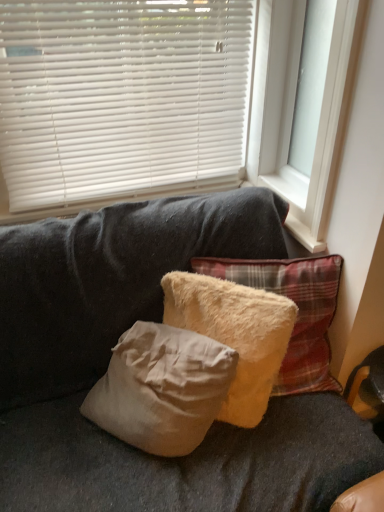
Question: Does white plastic blinds at upper center have a greater height compared to white plastic window frame at upper right?

Choices:
 (A) no
 (B) yes

Answer: (A)

Question: Is white plastic blinds at upper center next to white plastic window frame at upper right and touching it?

Choices:
 (A) yes
 (B) no

Answer: (B)

Question: Does white plastic blinds at upper center have a greater width compared to white plastic window frame at upper right?

Choices:
 (A) yes
 (B) no

Answer: (B)

Question: Considering the relative sizes of white plastic blinds at upper center and white plastic window frame at upper right in the image provided, is white plastic blinds at upper center bigger than white plastic window frame at upper right?

Choices:
 (A) no
 (B) yes

Answer: (B)

Question: Is white plastic blinds at upper center at the right side of white plastic window frame at upper right?

Choices:
 (A) no
 (B) yes

Answer: (A)

Question: From the image's perspective, does white plastic blinds at upper center appear higher than white plastic window frame at upper right?

Choices:
 (A) no
 (B) yes

Answer: (B)

Question: Does white plastic window frame at upper right have a lesser height compared to beige fluffy pillow at center, positioned as the second pillow in right-to-left order?

Choices:
 (A) yes
 (B) no

Answer: (B)

Question: Does white plastic window frame at upper right appear on the left side of beige fluffy pillow at center, positioned as the second pillow in right-to-left order?

Choices:
 (A) no
 (B) yes

Answer: (A)

Question: Is white plastic window frame at upper right bigger than beige fluffy pillow at center, which ranks as the first pillow in left-to-right order?

Choices:
 (A) yes
 (B) no

Answer: (A)

Question: From the image's perspective, is white plastic window frame at upper right under beige fluffy pillow at center, which ranks as the first pillow in left-to-right order?

Choices:
 (A) yes
 (B) no

Answer: (B)

Question: Would you say white plastic window frame at upper right is a long distance from beige fluffy pillow at center, positioned as the second pillow in right-to-left order?

Choices:
 (A) yes
 (B) no

Answer: (B)

Question: Considering the relative sizes of white plastic window frame at upper right and beige fluffy pillow at center, positioned as the second pillow in right-to-left order, in the image provided, is white plastic window frame at upper right thinner than beige fluffy pillow at center, positioned as the second pillow in right-to-left order,?

Choices:
 (A) no
 (B) yes

Answer: (B)

Question: From a real-world perspective, is beige fluffy pillow at center, which ranks as the first pillow in left-to-right order, physically above white plastic window frame at upper right?

Choices:
 (A) no
 (B) yes

Answer: (A)